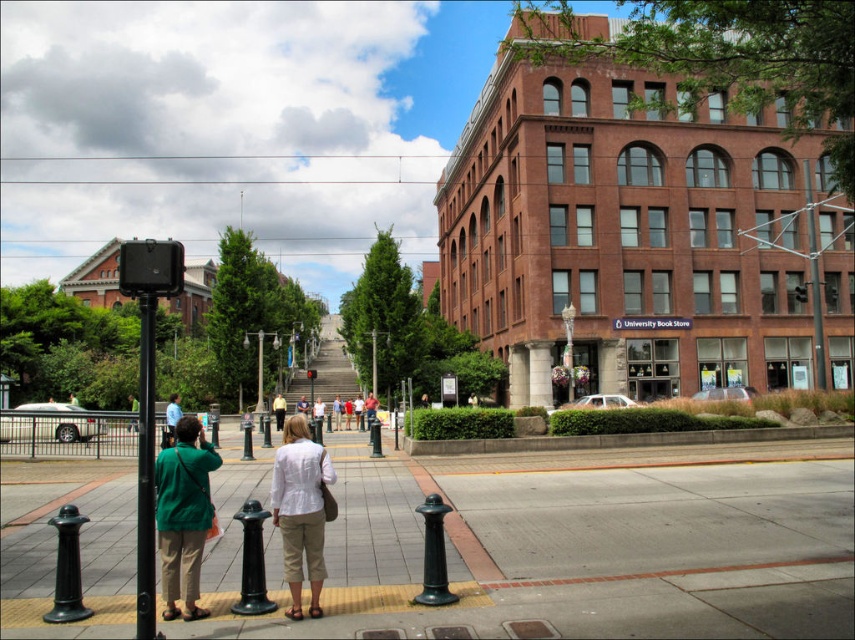
Question: Among these points, which one is farthest from the camera?

Choices:
 (A) (205, 509)
 (B) (275, 458)
 (C) (152, 429)

Answer: (B)

Question: Considering the real-world distances, which object is farthest from the light brown leather jacket at center?

Choices:
 (A) white cotton shirt at center
 (B) black metal pole at left
 (C) smooth concrete sidewalk at center

Answer: (A)

Question: Is smooth concrete sidewalk at center bigger than black metal pole at left?

Choices:
 (A) yes
 (B) no

Answer: (B)

Question: Is white cotton shirt at center further to camera compared to light brown leather jacket at center?

Choices:
 (A) no
 (B) yes

Answer: (A)

Question: Which of the following is the farthest from the observer?

Choices:
 (A) (146, 605)
 (B) (675, 625)

Answer: (B)

Question: Is green matte jacket at lower left wider than light brown leather jacket at center?

Choices:
 (A) yes
 (B) no

Answer: (B)